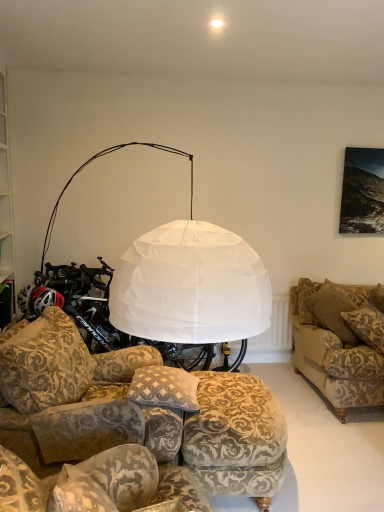
The image size is (384, 512). What do you see at coordinates (235, 437) in the screenshot? I see `patterned fabric footrest at lower center` at bounding box center [235, 437].

This screenshot has width=384, height=512. Describe the element at coordinates (334, 359) in the screenshot. I see `velvet-patterned couch at right, the 3th studio couch when ordered from left to right` at that location.

Locate an element on the screen. The image size is (384, 512). patterned fabric couch at lower left, positioned as the third studio couch in right-to-left order is located at coordinates (99, 483).

This screenshot has height=512, width=384. In the image, there is a patterned fabric ottoman at lower center, the second studio couch from the right. What are the coordinates of `lighting above it (from the image's perspective)` in the screenshot? It's located at (217, 23).

Measure the distance between white paper lampshade at upper center and patterned fabric ottoman at lower center, which is the first studio couch in front-to-back order.

The distance of white paper lampshade at upper center from patterned fabric ottoman at lower center, which is the first studio couch in front-to-back order, is 2.23 meters.

Is white paper lampshade at upper center facing towards patterned fabric ottoman at lower center, which is the first studio couch in front-to-back order?

No, white paper lampshade at upper center is not turned towards patterned fabric ottoman at lower center, which is the first studio couch in front-to-back order.

Is white paper lampshade at upper center far away from patterned fabric ottoman at lower center, the 2th studio couch in the left-to-right sequence?

Absolutely, white paper lampshade at upper center is distant from patterned fabric ottoman at lower center, the 2th studio couch in the left-to-right sequence.

Is point (72, 471) positioned after point (221, 20)?

No, (72, 471) is in front of (221, 20).

Relative to white paper lampshade at upper center, is patterned fabric couch at lower left, the second studio couch viewed from the front, in front or behind?

patterned fabric couch at lower left, the second studio couch viewed from the front, is positioned closer to the viewer than white paper lampshade at upper center.

From the image's perspective, is patterned fabric couch at lower left, positioned as the third studio couch in right-to-left order, located beneath white paper lampshade at upper center?

Indeed, from the image's perspective, patterned fabric couch at lower left, positioned as the third studio couch in right-to-left order, is shown beneath white paper lampshade at upper center.

Between velvet-patterned couch at right, which is counted as the first studio couch, starting from the right, and patterned fabric ottoman at lower center, arranged as the third studio couch when viewed from the back, which one has larger size?

With larger size is patterned fabric ottoman at lower center, arranged as the third studio couch when viewed from the back.

Is velvet-patterned couch at right, which is counted as the first studio couch, starting from the right, oriented away from patterned fabric ottoman at lower center, which is the first studio couch in front-to-back order?

No, velvet-patterned couch at right, which is counted as the first studio couch, starting from the right,'s orientation is not away from patterned fabric ottoman at lower center, which is the first studio couch in front-to-back order.

Is the depth of velvet-patterned couch at right, the 3th studio couch when ordered from front to back, less than that of patterned fabric ottoman at lower center, the 2th studio couch in the left-to-right sequence?

No, the depth of velvet-patterned couch at right, the 3th studio couch when ordered from front to back, is greater than that of patterned fabric ottoman at lower center, the 2th studio couch in the left-to-right sequence.

Are velvet-patterned couch at right, the 3th studio couch when ordered from left to right, and patterned fabric ottoman at lower center, arranged as the third studio couch when viewed from the back, located far from each other?

That's right, there is a large distance between velvet-patterned couch at right, the 3th studio couch when ordered from left to right, and patterned fabric ottoman at lower center, arranged as the third studio couch when viewed from the back.

Considering the relative positions of patterned fabric ottoman at lower center, the second studio couch from the right, and white paper lampshade at upper center in the image provided, is patterned fabric ottoman at lower center, the second studio couch from the right, to the left of white paper lampshade at upper center from the viewer's perspective?

Yes, patterned fabric ottoman at lower center, the second studio couch from the right, is to the left of white paper lampshade at upper center.

Does patterned fabric ottoman at lower center, arranged as the third studio couch when viewed from the back, have a lesser width compared to white paper lampshade at upper center?

No.

Considering the sizes of objects patterned fabric ottoman at lower center, the 2th studio couch in the left-to-right sequence, and white paper lampshade at upper center in the image provided, who is shorter, patterned fabric ottoman at lower center, the 2th studio couch in the left-to-right sequence, or white paper lampshade at upper center?

white paper lampshade at upper center.

Between velvet-patterned couch at right, the 1th studio couch positioned from the back, and patterned fabric footrest at lower center, which one has larger width?

Wider between the two is patterned fabric footrest at lower center.

Consider the image. Which is farther, (382, 374) or (207, 402)?

The point (382, 374) is farther from the camera.

Who is more distant, velvet-patterned couch at right, the 3th studio couch when ordered from front to back, or patterned fabric footrest at lower center?

velvet-patterned couch at right, the 3th studio couch when ordered from front to back.

Considering the sizes of velvet-patterned couch at right, the 1th studio couch positioned from the back, and patterned fabric footrest at lower center in the image, is velvet-patterned couch at right, the 1th studio couch positioned from the back, taller or shorter than patterned fabric footrest at lower center?

Considering their sizes, velvet-patterned couch at right, the 1th studio couch positioned from the back, has more height than patterned fabric footrest at lower center.

Does point (28, 450) come behind point (211, 410)?

No, it is not.

Considering the sizes of objects patterned fabric ottoman at lower center, the second studio couch from the right, and patterned fabric footrest at lower center in the image provided, who is bigger, patterned fabric ottoman at lower center, the second studio couch from the right, or patterned fabric footrest at lower center?

patterned fabric ottoman at lower center, the second studio couch from the right.

Which is correct: patterned fabric ottoman at lower center, which is the first studio couch in front-to-back order, is inside patterned fabric footrest at lower center, or outside of it?

patterned fabric ottoman at lower center, which is the first studio couch in front-to-back order, is located beyond the bounds of patterned fabric footrest at lower center.

In terms of height, does white paper lampshade at upper center look taller or shorter compared to patterned fabric couch at lower left, positioned as the third studio couch in right-to-left order?

white paper lampshade at upper center is shorter than patterned fabric couch at lower left, positioned as the third studio couch in right-to-left order.

From the image's perspective, is white paper lampshade at upper center under patterned fabric couch at lower left, the 2th studio couch when ordered from back to front?

No, from the image's perspective, white paper lampshade at upper center is not beneath patterned fabric couch at lower left, the 2th studio couch when ordered from back to front.

Does white paper lampshade at upper center turn towards patterned fabric couch at lower left, the second studio couch viewed from the front?

No.

Identify the location of lighting that is behind the patterned fabric couch at lower left, positioned as the third studio couch in right-to-left order. (217, 23).

Find the location of a particular element. This screenshot has height=512, width=384. the 3rd studio couch below the white paper lampshade at upper center (from a real-world perspective) is located at coordinates (134, 430).

The image size is (384, 512). Identify the location of the 1st studio couch in front when counting from the white paper lampshade at upper center. (99, 483).

Estimate the real-world distances between objects in this image. Which object is further from plush beige pillow at lower center, patterned fabric footrest at lower center or patterned fabric couch at lower left, the second studio couch viewed from the front?

patterned fabric couch at lower left, the second studio couch viewed from the front.

When comparing their distances from velvet-patterned couch at right, the 1th studio couch positioned from the back, does patterned fabric ottoman at lower center, the second studio couch from the right, or plush beige pillow at lower center seem further?

patterned fabric ottoman at lower center, the second studio couch from the right, is positioned further to the anchor velvet-patterned couch at right, the 1th studio couch positioned from the back.

Estimate the real-world distances between objects in this image. Which object is closer to patterned fabric footrest at lower center, plush beige pillow at lower center or white paper lampshade at upper center?

plush beige pillow at lower center is closer to patterned fabric footrest at lower center.

Looking at the image, which one is located closer to plush beige pillow at lower center, patterned fabric footrest at lower center or white paper lampshade at upper center?

Based on the image, patterned fabric footrest at lower center appears to be nearer to plush beige pillow at lower center.

Consider the image. Which object lies nearer to the anchor point patterned fabric ottoman at lower center, the 2th studio couch in the left-to-right sequence, white paper lampshade at upper center or plush beige pillow at lower center?

The object closer to patterned fabric ottoman at lower center, the 2th studio couch in the left-to-right sequence, is plush beige pillow at lower center.

Considering their positions, is plush beige pillow at lower center positioned closer to velvet-patterned couch at right, the 1th studio couch positioned from the back, than patterned fabric ottoman at lower center, the second studio couch from the right?

plush beige pillow at lower center.

Based on their spatial positions, is patterned fabric ottoman at lower center, the second studio couch from the right, or patterned fabric footrest at lower center further from velvet-patterned couch at right, the 3th studio couch when ordered from front to back?

Among the two, patterned fabric ottoman at lower center, the second studio couch from the right, is located further to velvet-patterned couch at right, the 3th studio couch when ordered from front to back.

Which object lies further to the anchor point patterned fabric couch at lower left, which is the first studio couch in left-to-right order, white paper lampshade at upper center or patterned fabric ottoman at lower center, the 2th studio couch in the left-to-right sequence?

Based on the image, white paper lampshade at upper center appears to be further to patterned fabric couch at lower left, which is the first studio couch in left-to-right order.

Locate an element on the screen. The width and height of the screenshot is (384, 512). the footrest positioned between patterned fabric ottoman at lower center, which is the first studio couch in front-to-back order, and velvet-patterned couch at right, which is counted as the first studio couch, starting from the right, from near to far is located at coordinates (235, 437).

Image resolution: width=384 pixels, height=512 pixels. In order to click on studio couch between patterned fabric ottoman at lower center, the 2th studio couch in the left-to-right sequence, and velvet-patterned couch at right, the 1th studio couch positioned from the back, in the front-back direction in this screenshot , I will do `click(99, 483)`.

This screenshot has width=384, height=512. I want to click on the footrest positioned between patterned fabric couch at lower left, the 2th studio couch when ordered from back to front, and velvet-patterned couch at right, the 1th studio couch positioned from the back, from near to far, so click(x=235, y=437).

Where is `footrest between plush beige pillow at lower center and velvet-patterned couch at right, which is counted as the first studio couch, starting from the right`? Image resolution: width=384 pixels, height=512 pixels. footrest between plush beige pillow at lower center and velvet-patterned couch at right, which is counted as the first studio couch, starting from the right is located at coordinates (235, 437).